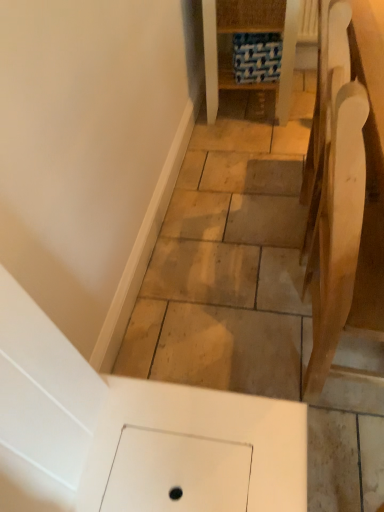
Describe the element at coordinates (333, 190) in the screenshot. I see `light brown wood chair at right, marked as the 2th furniture in a top-to-bottom arrangement` at that location.

Identify the location of light brown wood chair at right, which is the 1th furniture from front to back. Image resolution: width=384 pixels, height=512 pixels. (333, 190).

This screenshot has width=384, height=512. What do you see at coordinates (249, 31) in the screenshot? I see `blue fabric at center, which appears as the second furniture when viewed from the front` at bounding box center [249, 31].

Find the location of a particular element. blue fabric at center, marked as the 1th furniture in a top-to-bottom arrangement is located at coordinates (249, 31).

At what (x,y) coordinates should I click in order to perform the action: click on light brown wood chair at right, which is the 1th furniture from front to back. Please return your answer as a coordinate pair (x, y). Image resolution: width=384 pixels, height=512 pixels. Looking at the image, I should click on (333, 190).

Can you confirm if blue fabric at center, marked as the 1th furniture in a top-to-bottom arrangement, is positioned to the left of light brown wood chair at right, which is the 1th furniture from front to back?

Indeed, blue fabric at center, marked as the 1th furniture in a top-to-bottom arrangement, is positioned on the left side of light brown wood chair at right, which is the 1th furniture from front to back.

Is blue fabric at center, the 2th furniture when ordered from bottom to top, positioned behind light brown wood chair at right, acting as the 1th furniture starting from the bottom?

Yes, the depth of blue fabric at center, the 2th furniture when ordered from bottom to top, is greater than that of light brown wood chair at right, acting as the 1th furniture starting from the bottom.

Is point (291, 91) positioned in front of point (348, 128)?

That is False.

From the image's perspective, is blue fabric at center, marked as the 1th furniture in a top-to-bottom arrangement, beneath light brown wood chair at right, acting as the 1th furniture starting from the bottom?

Actually, blue fabric at center, marked as the 1th furniture in a top-to-bottom arrangement, appears above light brown wood chair at right, acting as the 1th furniture starting from the bottom, in the image.

From a real-world perspective, is blue fabric at center, which appears as the second furniture when viewed from the front, physically below light brown wood chair at right, which is the 1th furniture from front to back?

Yes.

Is blue fabric at center, the 2th furniture when ordered from bottom to top, wider than light brown wood chair at right, marked as the 2th furniture in a top-to-bottom arrangement?

Yes, blue fabric at center, the 2th furniture when ordered from bottom to top, is wider than light brown wood chair at right, marked as the 2th furniture in a top-to-bottom arrangement.

Between blue fabric at center, which appears as the second furniture when viewed from the front, and light brown wood chair at right, marked as the 2th furniture in a top-to-bottom arrangement, which one has more height?

With more height is light brown wood chair at right, marked as the 2th furniture in a top-to-bottom arrangement.

Can you confirm if blue fabric at center, marked as the 1th furniture in a top-to-bottom arrangement, is smaller than light brown wood chair at right, acting as the 1th furniture starting from the bottom?

No.

Is blue fabric at center, the 2th furniture when ordered from bottom to top, located outside light brown wood chair at right, the second furniture positioned from the back?

blue fabric at center, the 2th furniture when ordered from bottom to top, lies outside light brown wood chair at right, the second furniture positioned from the back,'s area.

Is blue fabric at center, the 2th furniture when ordered from bottom to top, next to light brown wood chair at right, acting as the 1th furniture starting from the bottom, and touching it?

No.

Is light brown wood chair at right, the second furniture positioned from the back, at the back of blue fabric at center, which is the first furniture in back-to-front order?

blue fabric at center, which is the first furniture in back-to-front order, does not have its back to light brown wood chair at right, the second furniture positioned from the back.

How many degrees apart are the facing directions of blue fabric at center, which is the first furniture in back-to-front order, and light brown wood chair at right, the second furniture positioned from the back?

The angular difference between blue fabric at center, which is the first furniture in back-to-front order, and light brown wood chair at right, the second furniture positioned from the back, is 1.8 degrees.

The image size is (384, 512). In order to click on furniture lying in front of the blue fabric at center, which appears as the second furniture when viewed from the front in this screenshot , I will do `click(333, 190)`.

Is light brown wood chair at right, the second furniture positioned from the back, to the left or to the right of blue fabric at center, which is the first furniture in back-to-front order, in the image?

Based on their positions, light brown wood chair at right, the second furniture positioned from the back, is located to the right of blue fabric at center, which is the first furniture in back-to-front order.

Which is in front, light brown wood chair at right, which is the 1th furniture from front to back, or blue fabric at center, which is the first furniture in back-to-front order?

light brown wood chair at right, which is the 1th furniture from front to back.

Does point (329, 3) come in front of point (223, 31)?

Yes, point (329, 3) is closer to viewer.

From the image's perspective, between light brown wood chair at right, acting as the 1th furniture starting from the bottom, and blue fabric at center, which appears as the second furniture when viewed from the front, which one is located above?

blue fabric at center, which appears as the second furniture when viewed from the front, from the image's perspective.

Looking at this image, from a real-world perspective, which is physically below, light brown wood chair at right, acting as the 1th furniture starting from the bottom, or blue fabric at center, the 2th furniture when ordered from bottom to top?

From a 3D spatial view, blue fabric at center, the 2th furniture when ordered from bottom to top, is below.

Looking at their sizes, would you say light brown wood chair at right, which is the 1th furniture from front to back, is wider or thinner than blue fabric at center, the 2th furniture when ordered from bottom to top?

light brown wood chair at right, which is the 1th furniture from front to back, is thinner than blue fabric at center, the 2th furniture when ordered from bottom to top.

Who is taller, light brown wood chair at right, acting as the 1th furniture starting from the bottom, or blue fabric at center, marked as the 1th furniture in a top-to-bottom arrangement?

light brown wood chair at right, acting as the 1th furniture starting from the bottom.

Between light brown wood chair at right, the second furniture positioned from the back, and blue fabric at center, the 2th furniture when ordered from bottom to top, which one has smaller size?

light brown wood chair at right, the second furniture positioned from the back.

Is light brown wood chair at right, the second furniture positioned from the back, not within blue fabric at center, which is the first furniture in back-to-front order?

light brown wood chair at right, the second furniture positioned from the back, is positioned outside blue fabric at center, which is the first furniture in back-to-front order.

Based on the photo, is light brown wood chair at right, marked as the 2th furniture in a top-to-bottom arrangement, oriented towards blue fabric at center, which is the first furniture in back-to-front order?

No, light brown wood chair at right, marked as the 2th furniture in a top-to-bottom arrangement, does not turn towards blue fabric at center, which is the first furniture in back-to-front order.

I want to click on furniture behind the light brown wood chair at right, which is the 1th furniture from front to back, so click(x=249, y=31).

This screenshot has height=512, width=384. Identify the location of furniture below the light brown wood chair at right, acting as the 1th furniture starting from the bottom (from a real-world perspective). (249, 31).

You are a GUI agent. You are given a task and a screenshot of the screen. Output one action in this format:
    pyautogui.click(x=<x>, y=<y>)
    Task: Click on the furniture on the left of light brown wood chair at right, the second furniture positioned from the back
    The width and height of the screenshot is (384, 512).
    Given the screenshot: What is the action you would take?
    pyautogui.click(x=249, y=31)